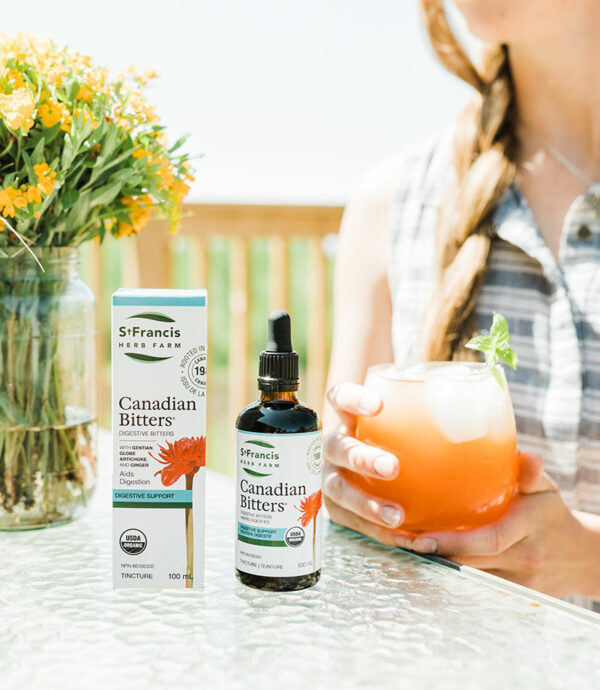
Image resolution: width=600 pixels, height=690 pixels. In order to click on wine glass in this screenshot , I will do `click(446, 480)`.